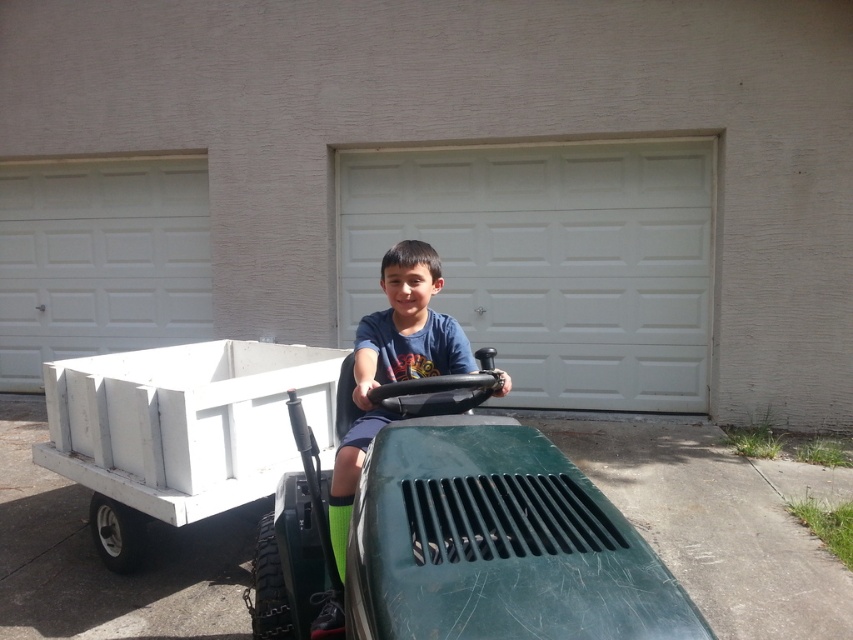
Question: Which point is closer to the camera taking this photo?

Choices:
 (A) (410, 332)
 (B) (111, 292)
 (C) (474, 484)

Answer: (C)

Question: Which object is positioned closest to the blue cotton shirt at center?

Choices:
 (A) white plastic wagon at center
 (B) white textured garage door at center

Answer: (A)

Question: Is the position of white textured garage door at center more distant than that of white textured garage door at left?

Choices:
 (A) no
 (B) yes

Answer: (A)

Question: Is white textured garage door at center to the left of white textured garage door at left from the viewer's perspective?

Choices:
 (A) no
 (B) yes

Answer: (A)

Question: Which object appears closest to the camera in this image?

Choices:
 (A) blue cotton shirt at center
 (B) white plastic wagon at center
 (C) white textured garage door at center

Answer: (A)

Question: Does white plastic wagon at center lie behind blue cotton shirt at center?

Choices:
 (A) no
 (B) yes

Answer: (B)